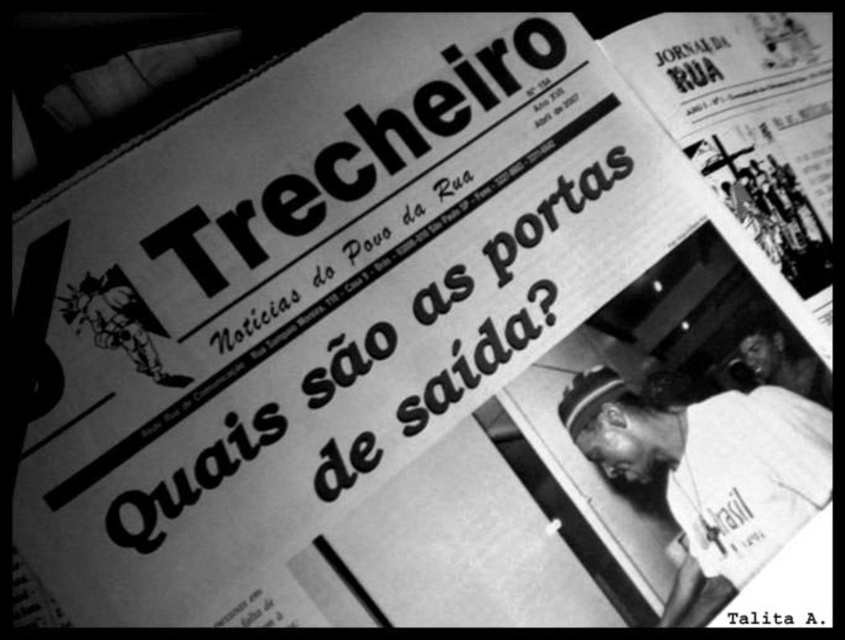
Question: In this image, where is white fabric cap at center located relative to smooth skin face at lower right?

Choices:
 (A) above
 (B) below

Answer: (B)

Question: Which of the following is the farthest from the observer?

Choices:
 (A) white fabric cap at center
 (B) smooth skin face at lower right

Answer: (B)

Question: Which point is farther to the camera?

Choices:
 (A) smooth skin face at lower right
 (B) white fabric cap at center

Answer: (A)

Question: Does white fabric cap at center appear over smooth skin face at lower right?

Choices:
 (A) no
 (B) yes

Answer: (A)

Question: Can you confirm if white fabric cap at center is positioned above smooth skin face at lower right?

Choices:
 (A) no
 (B) yes

Answer: (A)

Question: Which of the following is the closest to the observer?

Choices:
 (A) (829, 452)
 (B) (794, 387)

Answer: (A)